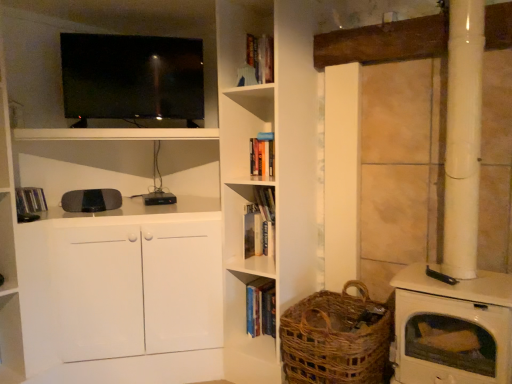
Question: Considering the relative sizes of hardcover book at center, which is the 2th book from top to bottom, and matte black tv at upper left in the image provided, is hardcover book at center, which is the 2th book from top to bottom, shorter than matte black tv at upper left?

Choices:
 (A) yes
 (B) no

Answer: (A)

Question: Is hardcover book at center, which is the 2th book from top to bottom, with matte black tv at upper left?

Choices:
 (A) no
 (B) yes

Answer: (A)

Question: Is hardcover book at center, the second book in the bottom-to-top sequence, bigger than matte black tv at upper left?

Choices:
 (A) no
 (B) yes

Answer: (A)

Question: From the image's perspective, is hardcover book at center, the 2th book viewed from the right, on matte black tv at upper left?

Choices:
 (A) yes
 (B) no

Answer: (B)

Question: Is hardcover book at center, which ranks as the second book in left-to-right order, to the right of matte black tv at upper left from the viewer's perspective?

Choices:
 (A) no
 (B) yes

Answer: (B)

Question: Visually, is woven brown basket at lower right positioned to the left or to the right of hardcover book at left, the 3th book from the bottom?

Choices:
 (A) right
 (B) left

Answer: (A)

Question: Relative to hardcover book at left, acting as the 1th book starting from the left, is woven brown basket at lower right in front or behind?

Choices:
 (A) front
 (B) behind

Answer: (A)

Question: From a real-world perspective, relative to hardcover book at left, which is the 3th book in right-to-left order, is woven brown basket at lower right vertically above or below?

Choices:
 (A) above
 (B) below

Answer: (B)

Question: Does point [x=309, y=337] appear closer or farther from the camera than point [x=38, y=201]?

Choices:
 (A) closer
 (B) farther

Answer: (A)

Question: From a real-world perspective, is matte black tv at upper left physically located above or below hardcover book at center, the third book positioned from the top?

Choices:
 (A) above
 (B) below

Answer: (A)

Question: Is point (113, 89) positioned closer to the camera than point (257, 301)?

Choices:
 (A) closer
 (B) farther

Answer: (A)

Question: Is matte black tv at upper left bigger or smaller than hardcover book at center, marked as the 1th book in a right-to-left arrangement?

Choices:
 (A) big
 (B) small

Answer: (A)

Question: In terms of height, does matte black tv at upper left look taller or shorter compared to hardcover book at center, marked as the 1th book in a right-to-left arrangement?

Choices:
 (A) tall
 (B) short

Answer: (A)

Question: Considering the positions of hardcover book at left, positioned as the first book in top-to-bottom order, and hardcover book at center, the 2th book viewed from the right, in the image, is hardcover book at left, positioned as the first book in top-to-bottom order, bigger or smaller than hardcover book at center, the 2th book viewed from the right,?

Choices:
 (A) small
 (B) big

Answer: (B)

Question: Visually, is hardcover book at left, the 3th book from the bottom, positioned to the left or to the right of hardcover book at center, which is the 2th book from top to bottom?

Choices:
 (A) right
 (B) left

Answer: (B)